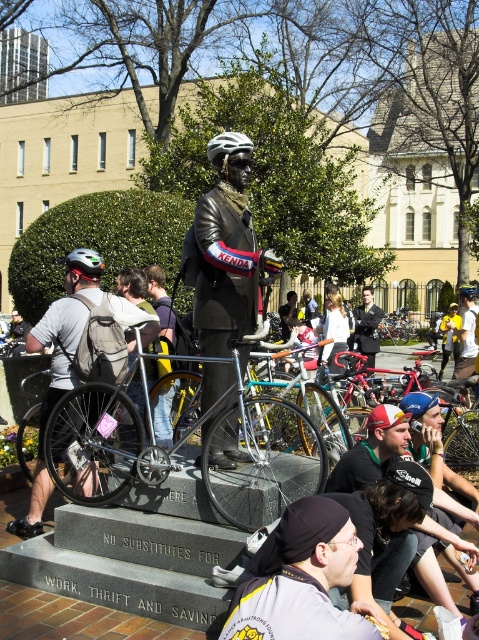
You are a photographer planning to take a photo of the shiny silver bicycle at center. You need to position your camera exactly at point [262,456] to capture the best angle. Can you confirm if the shiny silver bicycle at center is located precisely at that coordinate?

Yes, the shiny silver bicycle at center is located precisely at point [262,456] as stated in the description.

You are a photographer trying to capture the statue of the cyclist. You notice the yellow fabric helmet at upper right and the black leather jacket at center. Which object should you focus on first if you want to take a photo that includes both items in sharp focus?

The yellow fabric helmet at upper right is closer to the viewer than the black leather jacket at center. To capture both in sharp focus, you should focus on the yellow fabric helmet at upper right since it is the closer object, allowing the depth of field to extend to the farther black leather jacket at center.

You are a delivery person who needs to pick up a package from the bronze statue at center. The shiny silver bicycle at center is blocking the path. Can you move the bicycle to access the statue?

The shiny silver bicycle at center is below bronze statue at center, so you can access the statue by going around the bicycle or lifting the package from above since the bicycle is positioned lower.